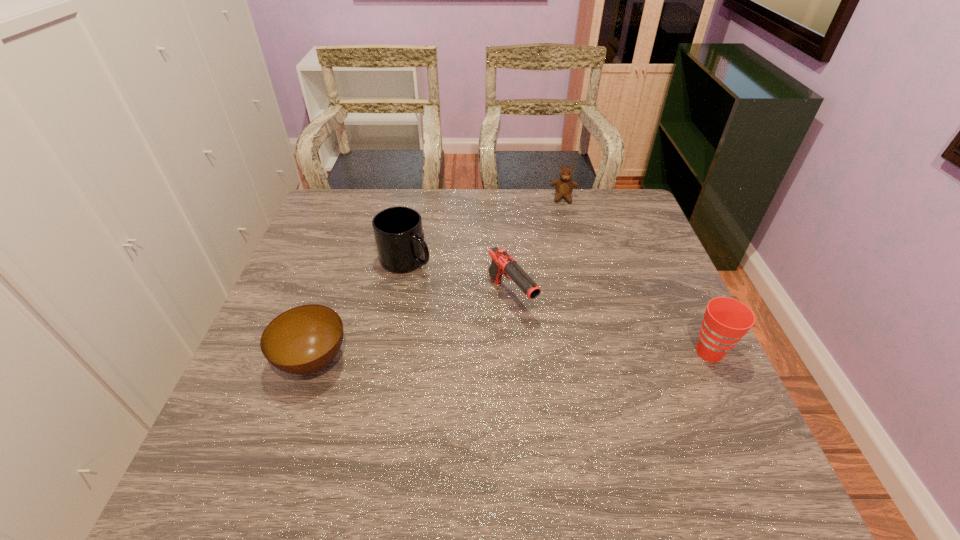
Where is `the shortest object`? Image resolution: width=960 pixels, height=540 pixels. the shortest object is located at coordinates (303, 340).

This screenshot has height=540, width=960. Identify the location of bowl. (303, 340).

Where is `the rightmost object`? This screenshot has height=540, width=960. the rightmost object is located at coordinates pos(726,320).

Where is `the farthest object`? The height and width of the screenshot is (540, 960). the farthest object is located at coordinates 564,186.

Locate an element on the screen. The image size is (960, 540). teddy bear is located at coordinates (564, 186).

The width and height of the screenshot is (960, 540). What are the coordinates of `mug` in the screenshot? It's located at (398, 231).

Locate an element on the screen. The width and height of the screenshot is (960, 540). the third object from left to right is located at coordinates (502, 263).

At what (x,y) coordinates should I click in order to perform the action: click on vacant space located on the right of the leftmost object. Please return your answer as a coordinate pair (x, y). This screenshot has height=540, width=960. Looking at the image, I should click on (385, 360).

Image resolution: width=960 pixels, height=540 pixels. What are the coordinates of `vacant space located 0.390m on the back of the rightmost object` in the screenshot? It's located at (655, 237).

This screenshot has height=540, width=960. Find the location of `blank space located 0.090m at the face of the second object from right to left`. blank space located 0.090m at the face of the second object from right to left is located at coordinates (563, 220).